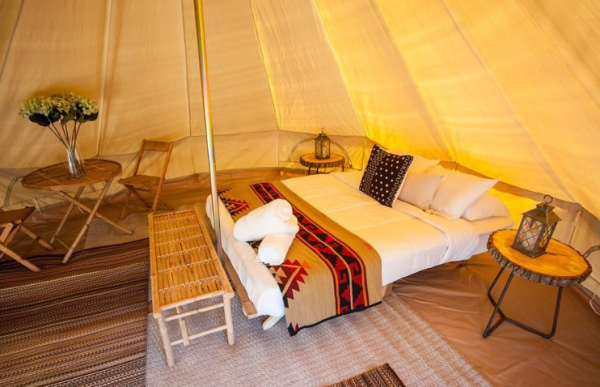
At what (x,y) coordinates should I click in order to perform the action: click on floor. Please return your answer as a coordinate pair (x, y). This screenshot has width=600, height=387. Looking at the image, I should click on (428, 358).